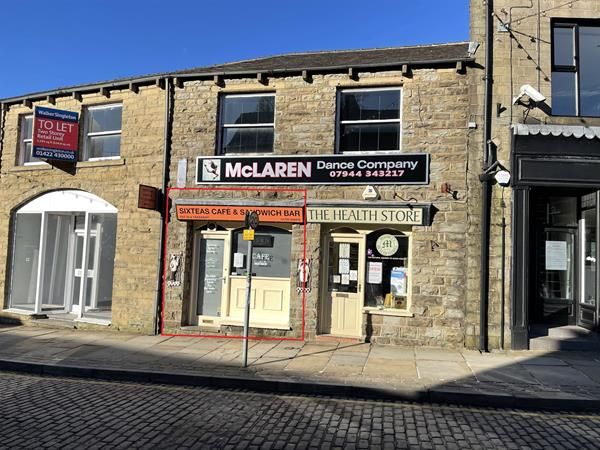
Where is `white print on door`? white print on door is located at coordinates (213, 285).